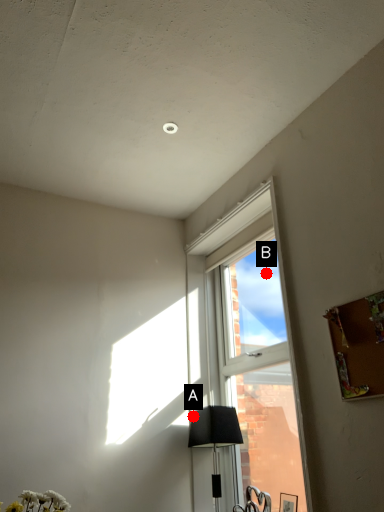
Question: Two points are circled on the image, labeled by A and B beside each circle. Which point appears farthest from the camera in this image?

Choices:
 (A) A is further
 (B) B is further

Answer: (A)